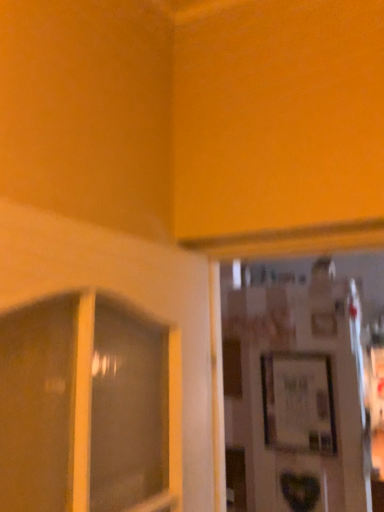
Where is `matte white picture frame at center`? Image resolution: width=384 pixels, height=512 pixels. matte white picture frame at center is located at coordinates (298, 403).

Describe the element at coordinates (298, 403) in the screenshot. I see `matte white picture frame at center` at that location.

In order to face matte white picture frame at center, should I rotate leftwards or rightwards?

A 14.793 degree turn to the right will do.

Find the location of `matte white picture frame at center`. matte white picture frame at center is located at coordinates (298, 403).